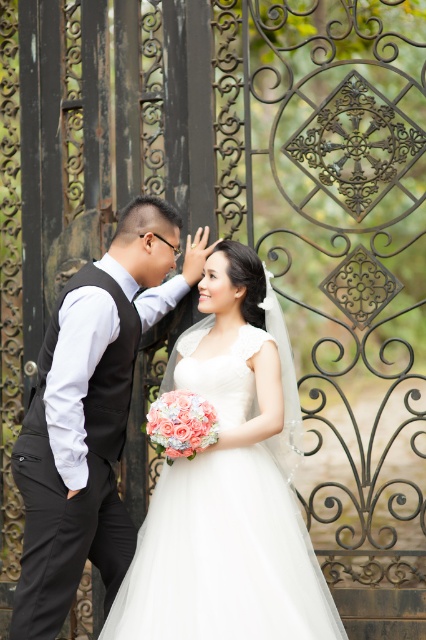
Question: Which object is closer to the camera taking this photo?

Choices:
 (A) white satin dress at center
 (B) black satin vest at left

Answer: (A)

Question: Can you confirm if white satin dress at center is smaller than black satin vest at left?

Choices:
 (A) yes
 (B) no

Answer: (B)

Question: Does white satin dress at center have a smaller size compared to black satin vest at left?

Choices:
 (A) no
 (B) yes

Answer: (A)

Question: Which point is closer to the camera?

Choices:
 (A) (106, 612)
 (B) (189, 554)

Answer: (B)

Question: From the image, what is the correct spatial relationship of white satin dress at center in relation to black satin vest at left?

Choices:
 (A) left
 (B) right

Answer: (B)

Question: Which point is farther to the camera?

Choices:
 (A) (215, 276)
 (B) (120, 552)

Answer: (A)